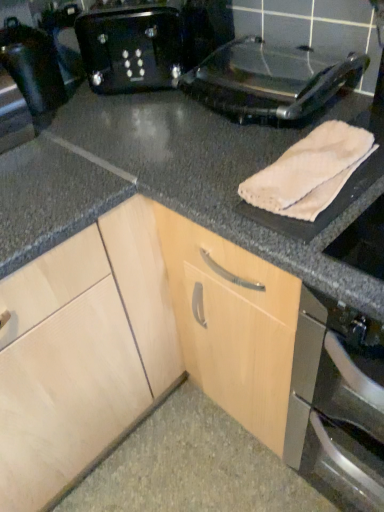
Where is `empty space that is ontop of beige soft towel at upper right`? The image size is (384, 512). empty space that is ontop of beige soft towel at upper right is located at coordinates (311, 154).